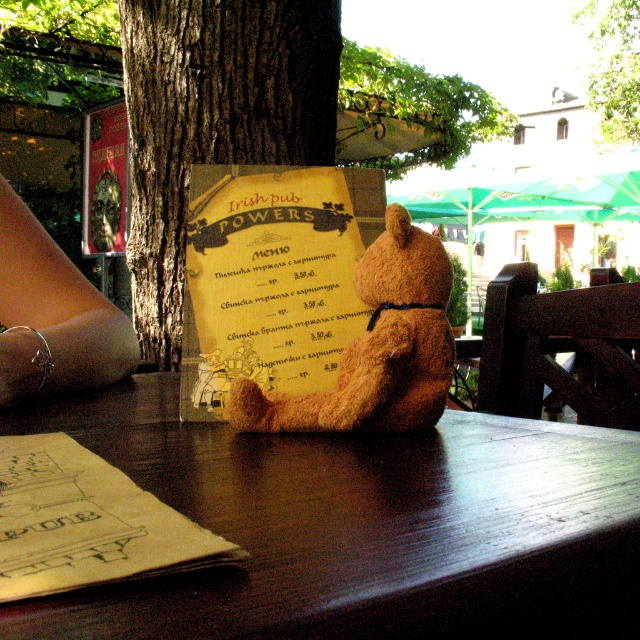
Between brown rough bark tree at center and brown plush bear at center, which one appears on the left side from the viewer's perspective?

Positioned to the left is brown rough bark tree at center.

Who is lower down, brown rough bark tree at center or brown plush bear at center?

brown plush bear at center is lower down.

Who is more forward, (145, 140) or (406, 428)?

Point (406, 428) is in front.

Identify the location of brown rough bark tree at center. Image resolution: width=640 pixels, height=640 pixels. (212, 122).

Can you confirm if brown plush bear at center is taller than green leafy tree at upper right?

No, brown plush bear at center is not taller than green leafy tree at upper right.

Find the location of a particular element. Image resolution: width=640 pixels, height=640 pixels. brown plush bear at center is located at coordinates (376, 348).

Does point (387, 308) come farther from viewer compared to point (408, 164)?

No, (387, 308) is in front of (408, 164).

Can you confirm if brown plush bear at center is thinner than green leafy tree at upper center?

Yes, brown plush bear at center is thinner than green leafy tree at upper center.

In order to click on brown plush bear at center in this screenshot , I will do `click(376, 348)`.